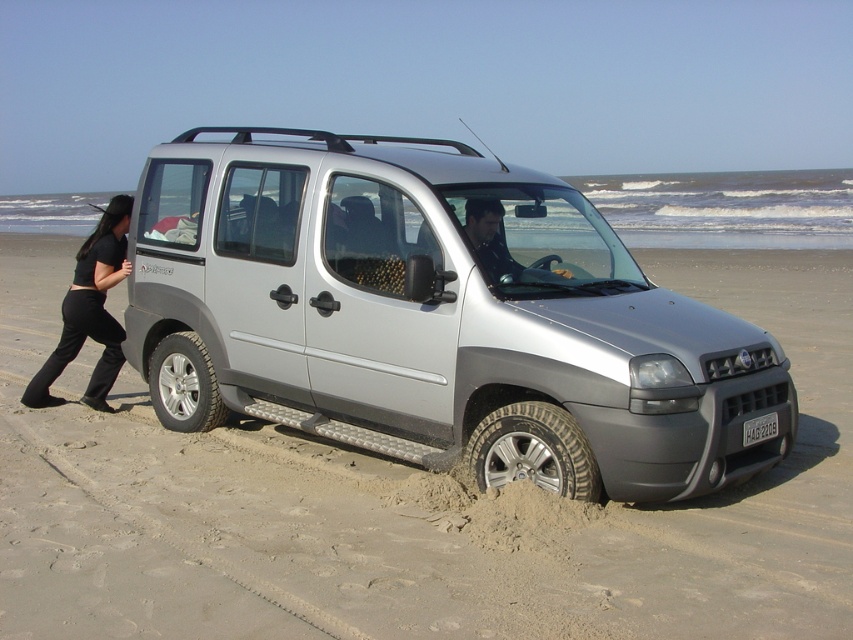
From the picture: You are a beachgoer trying to free the stuck car. You notice the black cotton pants at left and the silver metallic tire at lower left. Which object is taller?

The black cotton pants at left is much taller than the silver metallic tire at lower left.